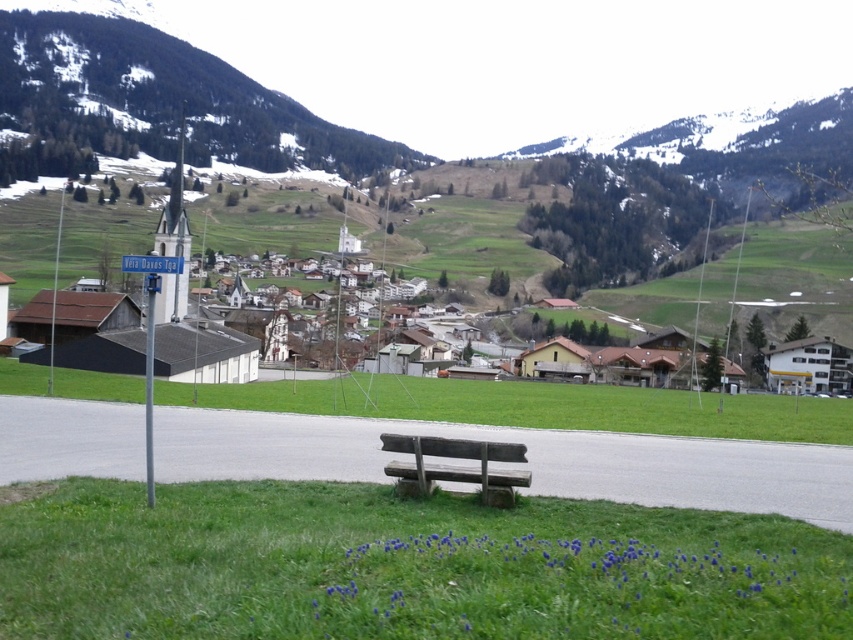
You are standing at the edge of the green grass at lower center looking towards the snowy rocky mountain at upper left. Which object is closer to you?

The green grass at lower center is closer to you because it is positioned in front of the snowy rocky mountain at upper left.

You are a hiker planning to take a photo of the green grass at center from the snowy rocky mountain at upper left. Is the mountain high enough to provide a clear view of the grass?

The snowy rocky mountain at upper left is above green grass at center, so yes, the mountain is high enough to provide a clear view of the grass.

You are planning to take a photo of the green grass at lower center and the snowy rocky mountain at upper left. Which object should you focus on first if you want to capture both in a single frame without moving your camera?

You should focus on the snowy rocky mountain at upper left first because it occupies more space in the image than the green grass at lower center, allowing both to be captured effectively in the frame.